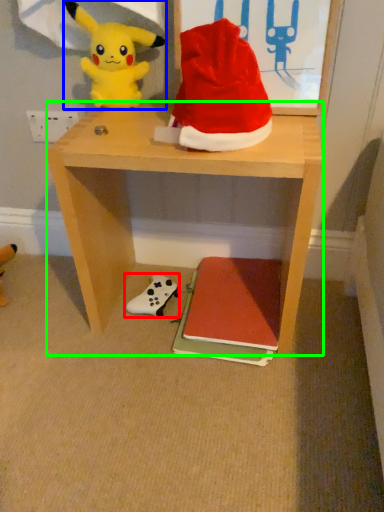
Question: Estimate the real-world distances between objects in this image. Which object is closer to toy (highlighted by a red box), toy (highlighted by a blue box) or desk (highlighted by a green box)?

Choices:
 (A) toy
 (B) desk

Answer: (B)